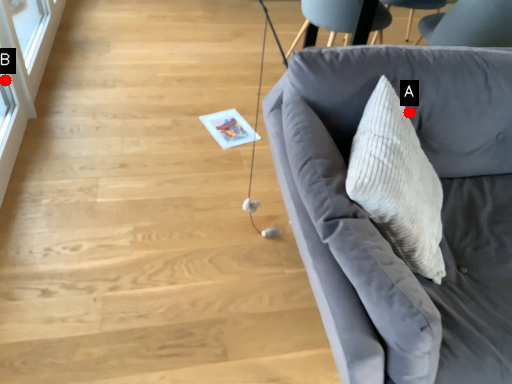
Question: Two points are circled on the image, labeled by A and B beside each circle. Which point appears closest to the camera in this image?

Choices:
 (A) A is closer
 (B) B is closer

Answer: (A)